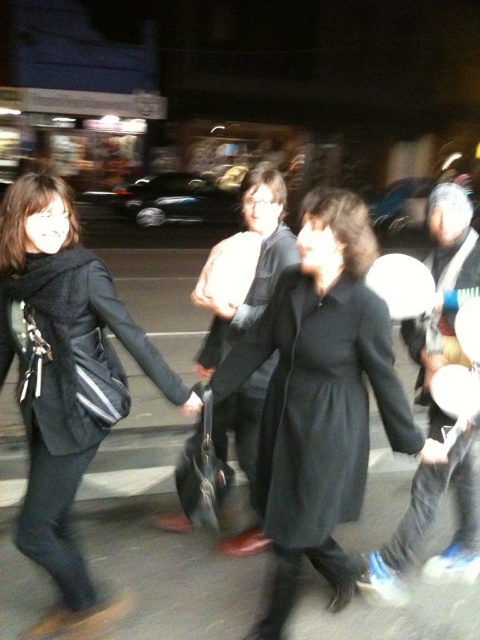
You are a photographer reviewing the image. You notice the matte black coat at left and the white matte hat at center. Which object appears shorter in the photo?

The matte black coat at left appears shorter than the white matte hat at center.

You are a photographer reviewing the image. You notice two coats in the scene. Which coat is positioned lower in the frame, the black matte coat at center or the matte black coat at left?

The black matte coat at center is positioned lower in the frame than the matte black coat at left.